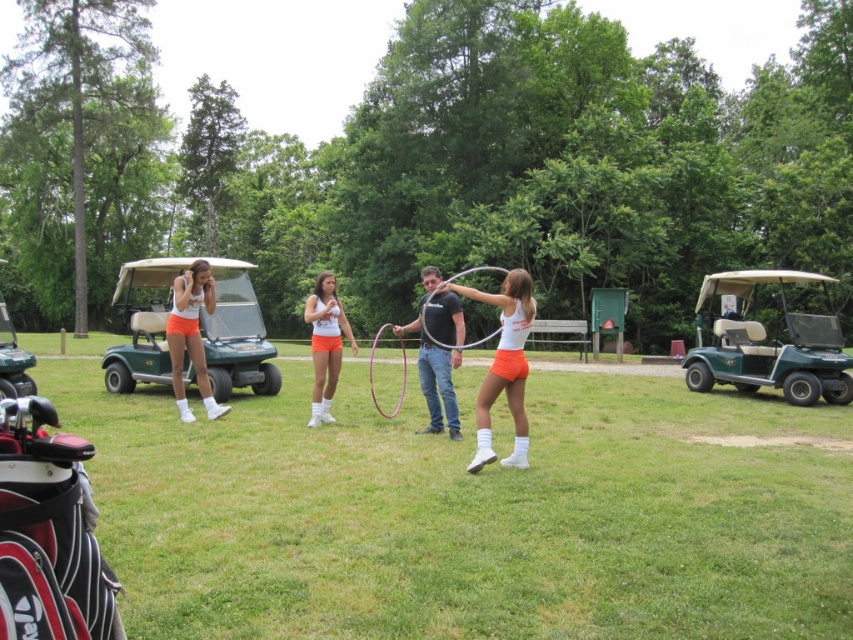
You are a photographer trying to capture a clear photo of the pink rubber hula hoop at center without the green matte golf cart at right blocking the view. Based on their sizes, can you position yourself in a way that the golf cart won

The green matte golf cart at right is much taller than the pink rubber hula hoop at center. To avoid the golf cart blocking the view, position yourself lower so that the hoop is visible above the cart or move to a side angle where the cart is not directly in front of the hoop.

You are standing at the origin point of the coordinate system in the image. The woman performing the hula hoop is at position 0.5,0.5. Where is the matte orange shorts at left located relative to the woman performing the hula hoop?

The matte orange shorts at left is located at coordinate point [190,337], which is slightly to the right and above the woman performing the hula hoop at [426,320].